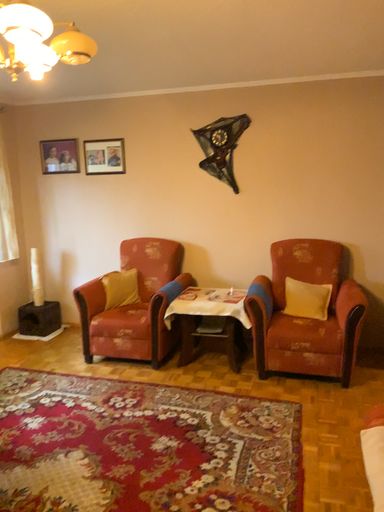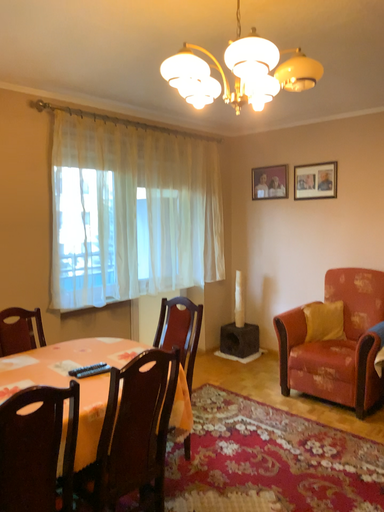
Question: How did the camera likely rotate when shooting the video?

Choices:
 (A) rotated right
 (B) rotated left

Answer: (B)